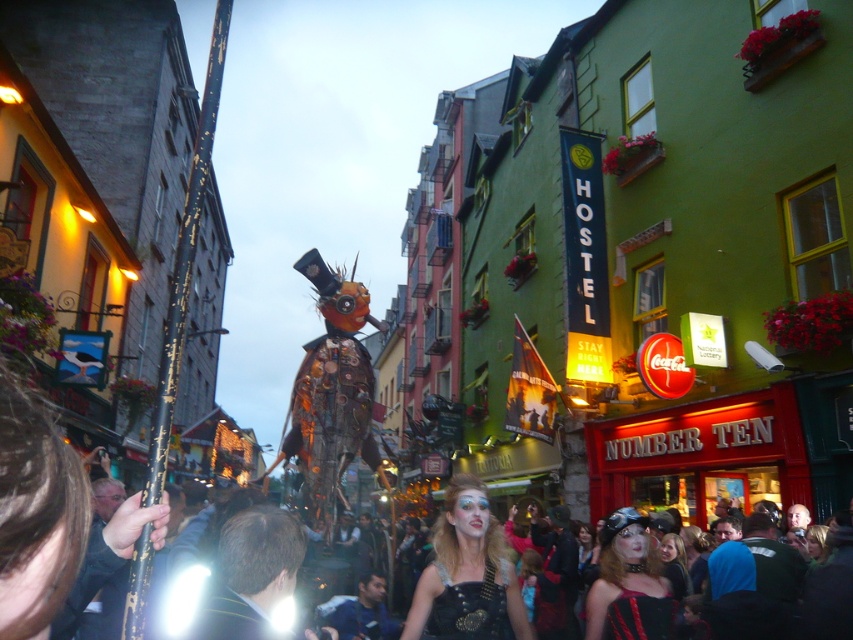
Question: Is shiny black leather dress at center thinner than black leather vest at center?

Choices:
 (A) no
 (B) yes

Answer: (A)

Question: Estimate the real-world distances between objects in this image. Which object is closer to the matte black dress at center?

Choices:
 (A) shiny black leather dress at center
 (B) black leather vest at center

Answer: (A)

Question: Can you confirm if shiny black leather dress at center is positioned to the right of matte black dress at center?

Choices:
 (A) no
 (B) yes

Answer: (A)

Question: Considering the real-world distances, which object is farthest from the shiny black leather dress at center?

Choices:
 (A) black leather vest at center
 (B) matte black dress at center

Answer: (B)

Question: Which object is positioned closest to the shiny black leather dress at center?

Choices:
 (A) matte black dress at center
 (B) black leather vest at center

Answer: (B)

Question: From the image, what is the correct spatial relationship of shiny black leather dress at center in relation to matte black dress at center?

Choices:
 (A) below
 (B) above

Answer: (A)